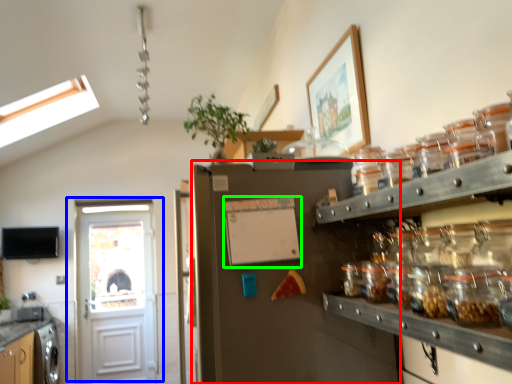
Question: Based on their relative distances, which object is farther from fridge (highlighted by a red box)? Choose from door (highlighted by a blue box) and bulletin board (highlighted by a green box).

Choices:
 (A) door
 (B) bulletin board

Answer: (A)